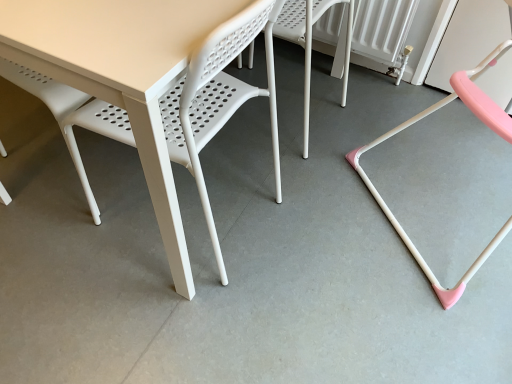
Question: Is white plastic chair at center, the 1th chair when ordered from left to right, turned away from pink plastic chair at right, the first chair when ordered from right to left?

Choices:
 (A) yes
 (B) no

Answer: (A)

Question: From the image's perspective, does white plastic chair at center, the 1th chair when ordered from left to right, appear lower than pink plastic chair at right, which is counted as the second chair, starting from the left?

Choices:
 (A) no
 (B) yes

Answer: (A)

Question: Would you say white plastic chair at center, the 1th chair when ordered from left to right, is outside pink plastic chair at right, the first chair when ordered from right to left?

Choices:
 (A) no
 (B) yes

Answer: (B)

Question: From a real-world perspective, is white plastic chair at center, the second chair viewed from the right, beneath pink plastic chair at right, which is counted as the second chair, starting from the left?

Choices:
 (A) yes
 (B) no

Answer: (A)

Question: Is white plastic chair at center, the 1th chair when ordered from left to right, bigger than pink plastic chair at right, the first chair when ordered from right to left?

Choices:
 (A) yes
 (B) no

Answer: (B)

Question: Is white plastic chair at center, the second chair viewed from the right, further to the viewer compared to pink plastic chair at right, which is counted as the second chair, starting from the left?

Choices:
 (A) no
 (B) yes

Answer: (B)

Question: Is pink plastic chair at right, the first chair when ordered from right to left, located within white plastic table at center?

Choices:
 (A) no
 (B) yes

Answer: (A)

Question: Would you say white plastic table at center is outside pink plastic chair at right, the first chair when ordered from right to left?

Choices:
 (A) yes
 (B) no

Answer: (A)

Question: Could you tell me if white plastic table at center is facing pink plastic chair at right, the first chair when ordered from right to left?

Choices:
 (A) yes
 (B) no

Answer: (B)

Question: Does white plastic table at center appear on the right side of pink plastic chair at right, the first chair when ordered from right to left?

Choices:
 (A) yes
 (B) no

Answer: (B)

Question: Is white plastic table at center facing away from pink plastic chair at right, which is counted as the second chair, starting from the left?

Choices:
 (A) no
 (B) yes

Answer: (A)

Question: Considering the relative sizes of white plastic table at center and pink plastic chair at right, which is counted as the second chair, starting from the left, in the image provided, is white plastic table at center thinner than pink plastic chair at right, which is counted as the second chair, starting from the left,?

Choices:
 (A) yes
 (B) no

Answer: (A)

Question: Can you confirm if pink plastic chair at right, which is counted as the second chair, starting from the left, is bigger than white plastic chair at center, the 1th chair when ordered from left to right?

Choices:
 (A) yes
 (B) no

Answer: (A)